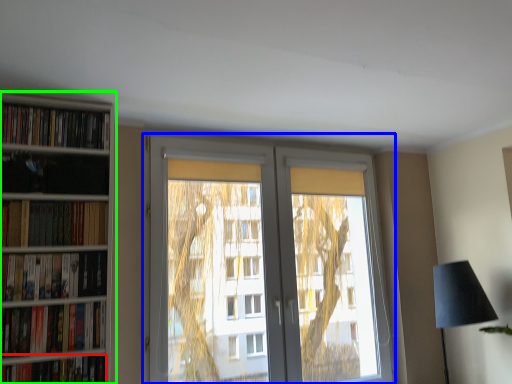
Question: Considering the real-world distances, which object is farthest from book (highlighted by a red box)? window (highlighted by a blue box) or bookcase (highlighted by a green box)?

Choices:
 (A) window
 (B) bookcase

Answer: (A)